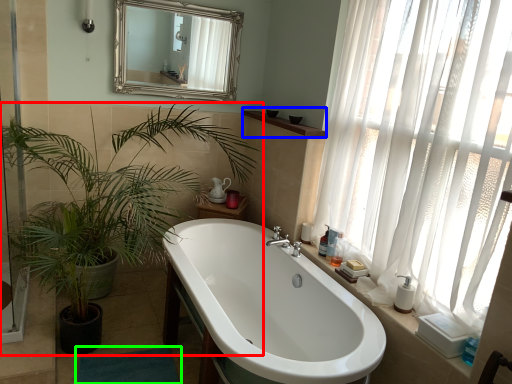
Question: Which object is positioned farthest from houseplant (highlighted by a red box)? Select from window sill (highlighted by a blue box) and bath mat (highlighted by a green box).

Choices:
 (A) window sill
 (B) bath mat

Answer: (A)